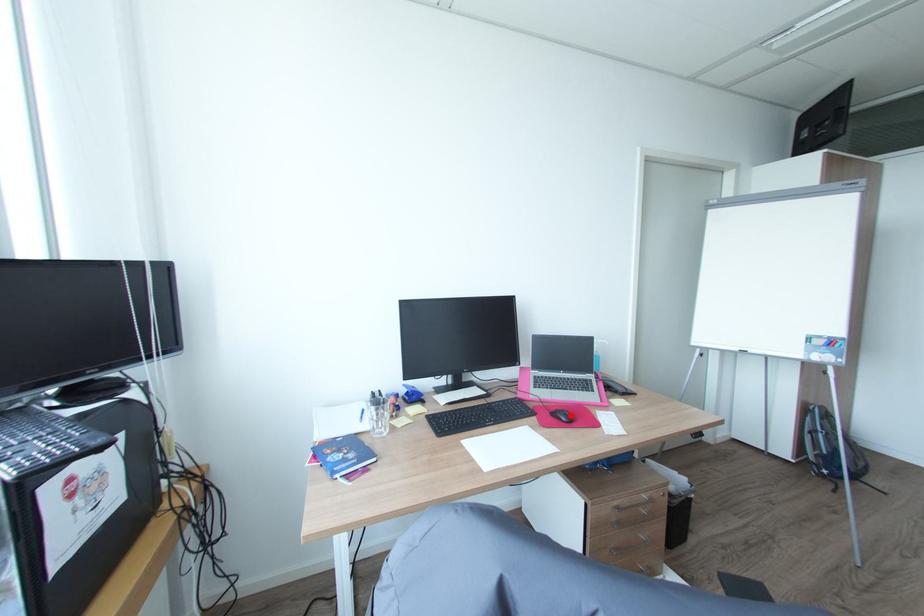
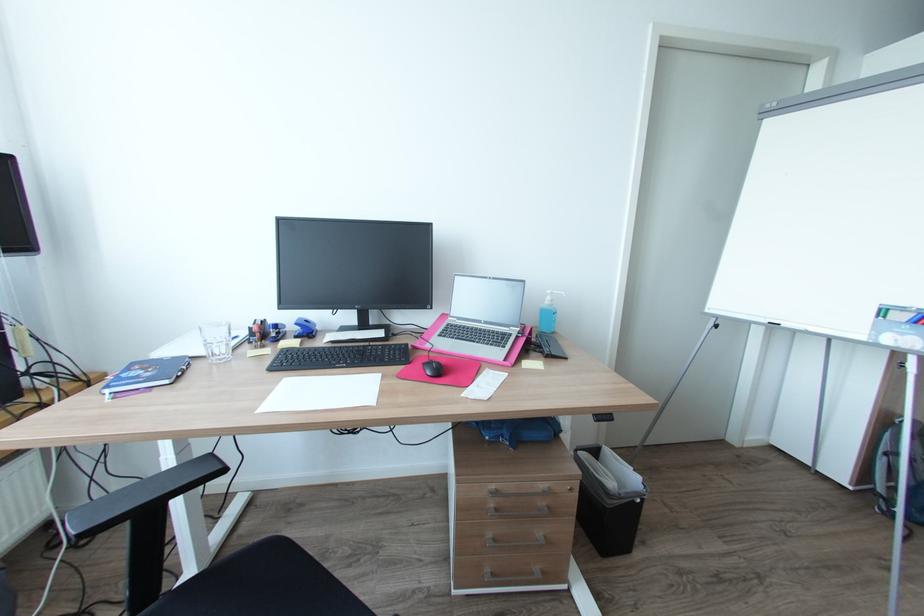
Where in the second image is the point corresponding to the highlighted location from the first image?

(438, 368)